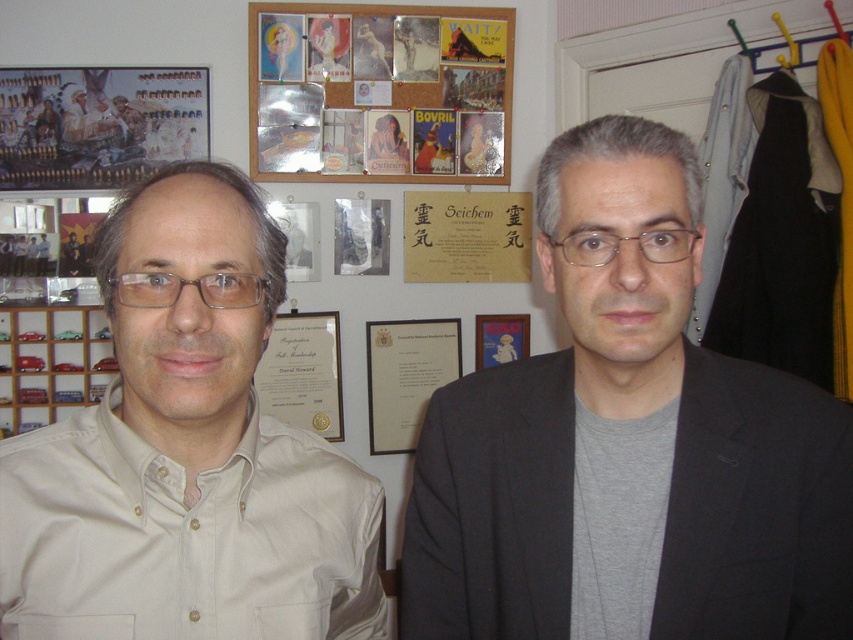
Which is below, corkboard at upper center or wooden framed painting at upper left?

wooden framed painting at upper left is lower down.

Can you confirm if corkboard at upper center is bigger than wooden framed painting at upper left?

Correct, corkboard at upper center is larger in size than wooden framed painting at upper left.

This screenshot has height=640, width=853. I want to click on corkboard at upper center, so click(x=387, y=88).

Who is shorter, beige button-down shirt at left or white paper certificate at center?

white paper certificate at center

Is beige button-down shirt at left bigger than white paper certificate at center?

Indeed, beige button-down shirt at left has a larger size compared to white paper certificate at center.

Which is behind, point (198, 456) or point (273, 324)?

The point (273, 324) is more distant.

Image resolution: width=853 pixels, height=640 pixels. I want to click on beige button-down shirt at left, so click(x=186, y=452).

Can you confirm if wooden framed painting at upper left is shorter than wooden plaque at upper center?

No, wooden framed painting at upper left is not shorter than wooden plaque at upper center.

Identify the location of wooden framed painting at upper left. (97, 124).